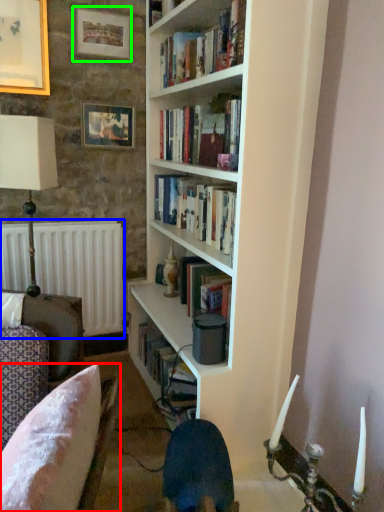
Question: Estimate the real-world distances between objects in this image. Which object is farther from chair (highlighted by a red box), radiator (highlighted by a blue box) or picture frame (highlighted by a green box)?

Choices:
 (A) radiator
 (B) picture frame

Answer: (B)